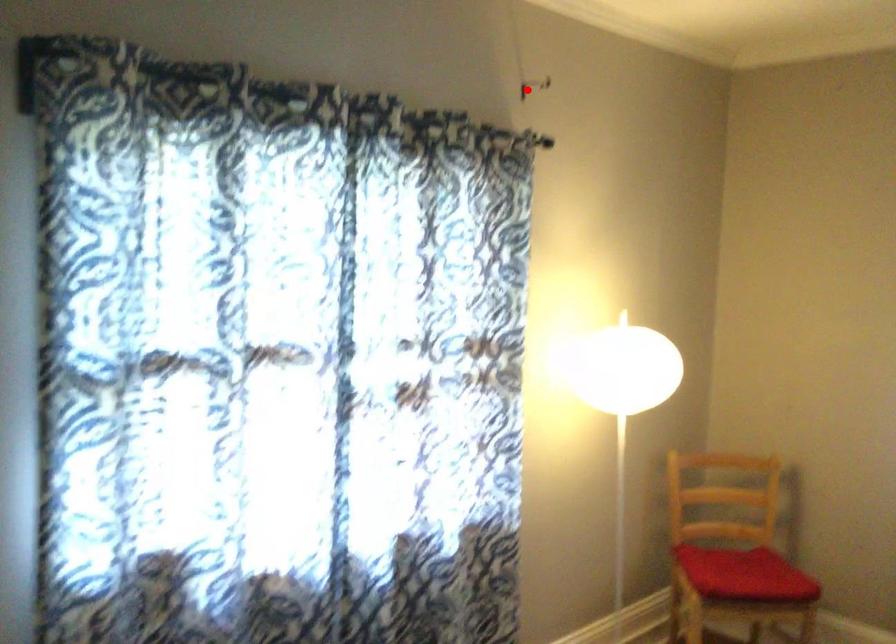
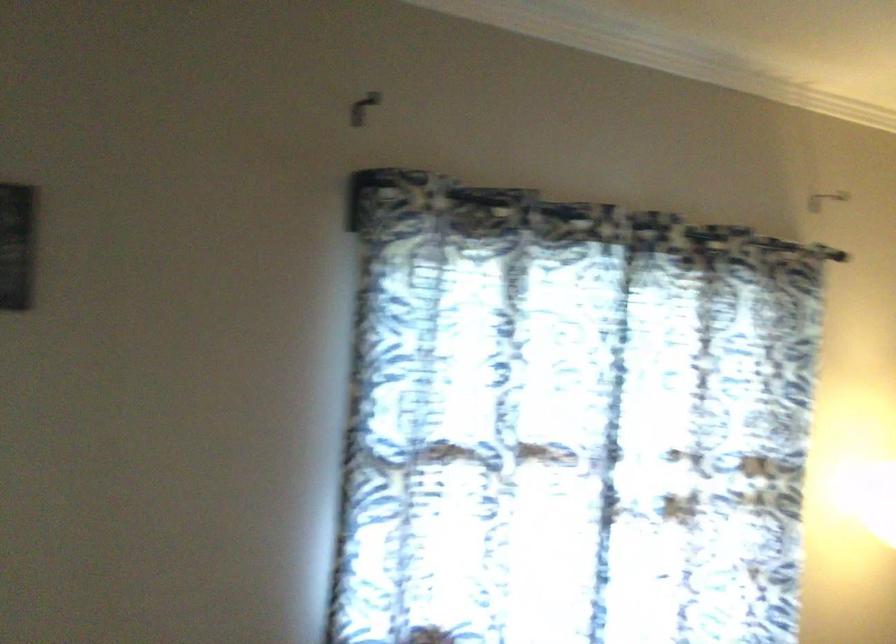
Locate, in the second image, the point that corresponds to the highlighted location in the first image.

(824, 199)